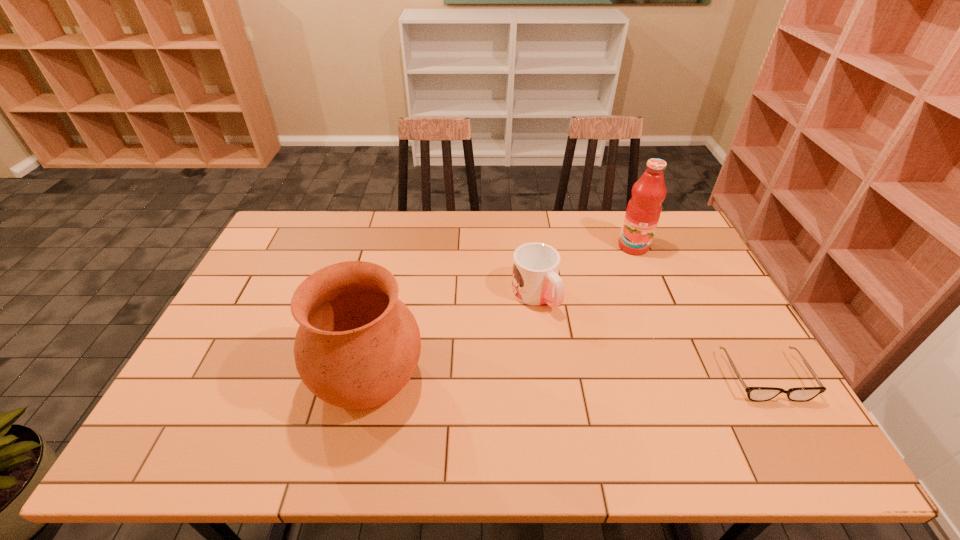
The image size is (960, 540). I want to click on free space on the desktop that is between the leftmost object and the shortest object and is positioned on the front label of the second object from right to left, so click(625, 376).

Locate an element on the screen. The width and height of the screenshot is (960, 540). free space on the desktop that is between the leftmost object and the rightmost object and is positioned on the side of the third object from right to left with the handle is located at coordinates (608, 376).